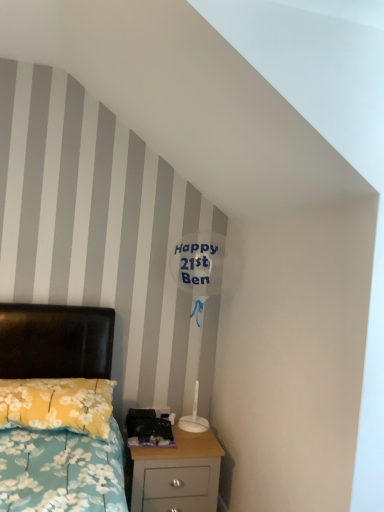
Question: Considering the relative positions of yellow floral fabric pillow at lower left and transparent plastic balloon at upper center in the image provided, is yellow floral fabric pillow at lower left to the left of transparent plastic balloon at upper center from the viewer's perspective?

Choices:
 (A) yes
 (B) no

Answer: (A)

Question: From the image's perspective, is yellow floral fabric pillow at lower left above transparent plastic balloon at upper center?

Choices:
 (A) no
 (B) yes

Answer: (A)

Question: Does yellow floral fabric pillow at lower left have a greater height compared to transparent plastic balloon at upper center?

Choices:
 (A) yes
 (B) no

Answer: (B)

Question: Considering the relative sizes of yellow floral fabric pillow at lower left and transparent plastic balloon at upper center in the image provided, is yellow floral fabric pillow at lower left smaller than transparent plastic balloon at upper center?

Choices:
 (A) no
 (B) yes

Answer: (B)

Question: From a real-world perspective, is yellow floral fabric pillow at lower left below transparent plastic balloon at upper center?

Choices:
 (A) yes
 (B) no

Answer: (A)

Question: Would you consider yellow floral fabric pillow at lower left to be distant from transparent plastic balloon at upper center?

Choices:
 (A) no
 (B) yes

Answer: (A)

Question: Is transparent plastic balloon at upper center positioned far away from light wood nightstand at lower right?

Choices:
 (A) no
 (B) yes

Answer: (A)

Question: Considering the relative positions of transparent plastic balloon at upper center and light wood nightstand at lower right in the image provided, is transparent plastic balloon at upper center behind light wood nightstand at lower right?

Choices:
 (A) no
 (B) yes

Answer: (B)

Question: Considering the relative sizes of transparent plastic balloon at upper center and light wood nightstand at lower right in the image provided, is transparent plastic balloon at upper center smaller than light wood nightstand at lower right?

Choices:
 (A) yes
 (B) no

Answer: (A)

Question: From a real-world perspective, is transparent plastic balloon at upper center positioned under light wood nightstand at lower right based on gravity?

Choices:
 (A) yes
 (B) no

Answer: (B)

Question: Is transparent plastic balloon at upper center facing away from light wood nightstand at lower right?

Choices:
 (A) no
 (B) yes

Answer: (A)

Question: Would you say transparent plastic balloon at upper center contains light wood nightstand at lower right?

Choices:
 (A) yes
 (B) no

Answer: (B)

Question: From a real-world perspective, is light wood nightstand at lower right under yellow floral fabric pillow at lower left?

Choices:
 (A) yes
 (B) no

Answer: (A)